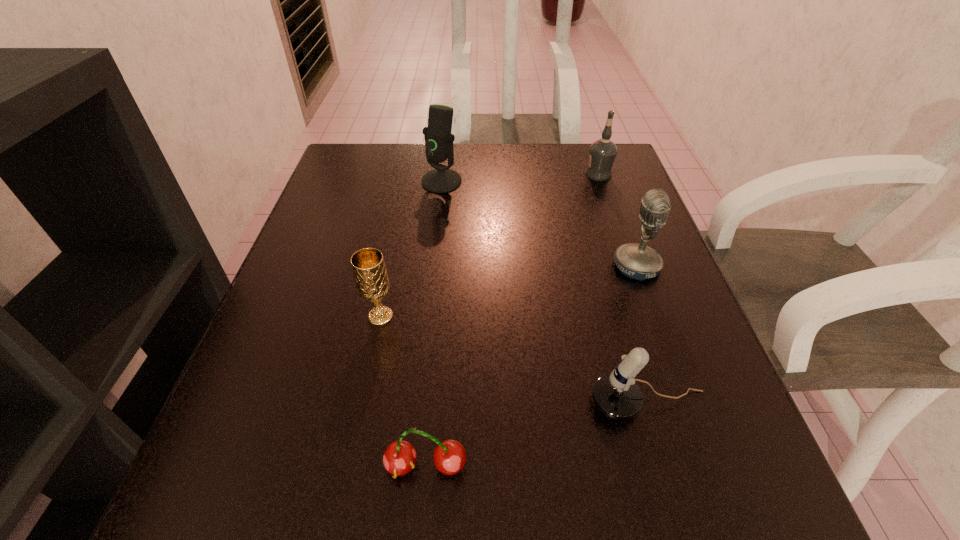
You are a GUI agent. You are given a task and a screenshot of the screen. Output one action in this format:
    pyautogui.click(x=<x>, y=<y>)
    Task: Click on the blank area located 0.080m on the front-facing side of the second farthest microphone
    
    Given the screenshot: What is the action you would take?
    pyautogui.click(x=572, y=266)

Identify the location of vacant space situated 0.400m on the front-facing side of the second farthest microphone. (411, 266).

Where is `free space located on the front-facing side of the second farthest microphone`? free space located on the front-facing side of the second farthest microphone is located at coordinates (502, 266).

Locate an element on the screen. The height and width of the screenshot is (540, 960). free space located 0.290m on the front label of the vodka is located at coordinates (469, 174).

In order to click on blank area located on the front label of the vodka in this screenshot , I will do `click(541, 174)`.

The width and height of the screenshot is (960, 540). Identify the location of vacant region located 0.170m on the front label of the vodka. (517, 174).

You are a GUI agent. You are given a task and a screenshot of the screen. Output one action in this format:
    pyautogui.click(x=<x>, y=<y>)
    Task: Click on the free space located on the right of the third nearest object
    
    Given the screenshot: What is the action you would take?
    (x=503, y=316)

In order to click on free space located on the back of the shortest microphone in this screenshot , I will do `click(632, 346)`.

Where is `microphone positioned at the far edge`? The width and height of the screenshot is (960, 540). microphone positioned at the far edge is located at coordinates (439, 141).

Find the location of a particular element. vodka that is at the far edge is located at coordinates tap(603, 151).